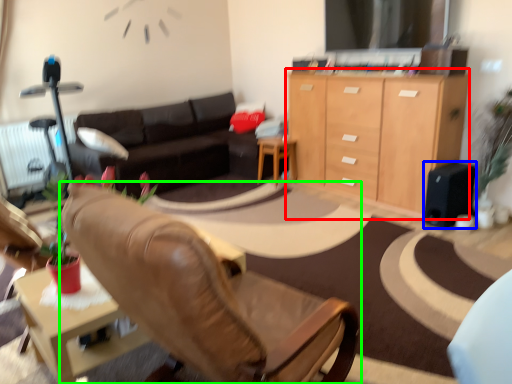
Question: Estimate the real-world distances between objects in this image. Which object is closer to cabinetry (highlighted by a red box), speaker (highlighted by a blue box) or chair (highlighted by a green box)?

Choices:
 (A) speaker
 (B) chair

Answer: (A)